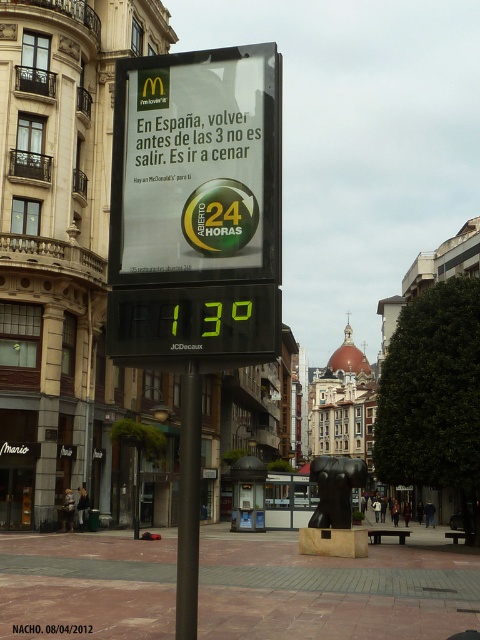
Image resolution: width=480 pixels, height=640 pixels. Describe the element at coordinates (196, 168) in the screenshot. I see `white paper sign at center` at that location.

Can you confirm if white paper sign at center is taller than black metal pole at center?

No, white paper sign at center is not taller than black metal pole at center.

Does point (144, 90) come farther from viewer compared to point (192, 522)?

Yes, point (144, 90) is behind point (192, 522).

I want to click on white paper sign at center, so click(x=196, y=168).